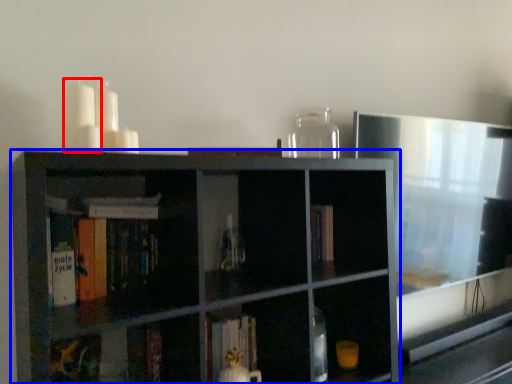
Question: Which object appears farthest to the camera in this image, candle (highlighted by a red box) or shelf (highlighted by a blue box)?

Choices:
 (A) candle
 (B) shelf

Answer: (A)